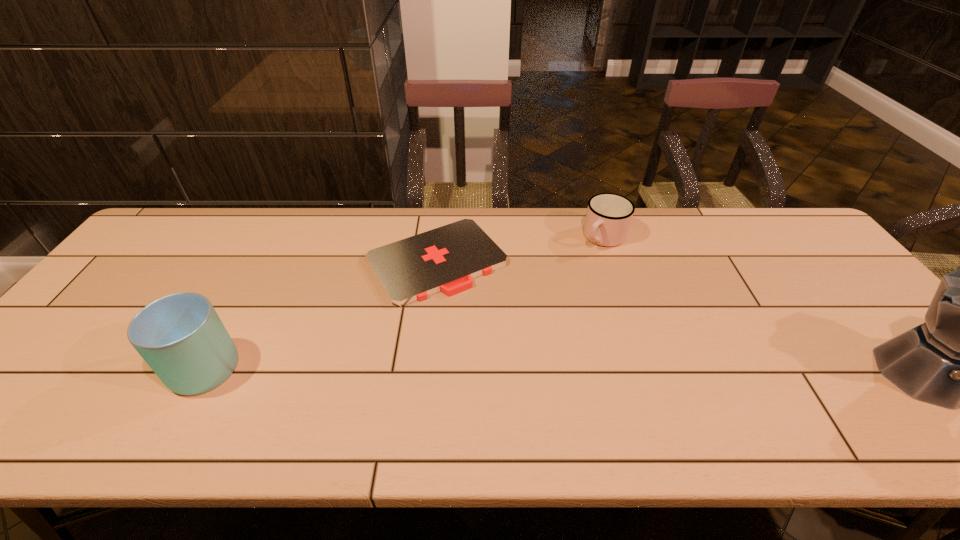
In order to click on vacant space on the desktop that is between the leftmost object and the rightmost object and is positioned on the side of the shorter mug with the handle in this screenshot , I will do `click(490, 369)`.

This screenshot has height=540, width=960. I want to click on vacant space on the desktop that is between the nearer mug and the coffeepot and is positioned on handle side the shortest object, so click(x=520, y=369).